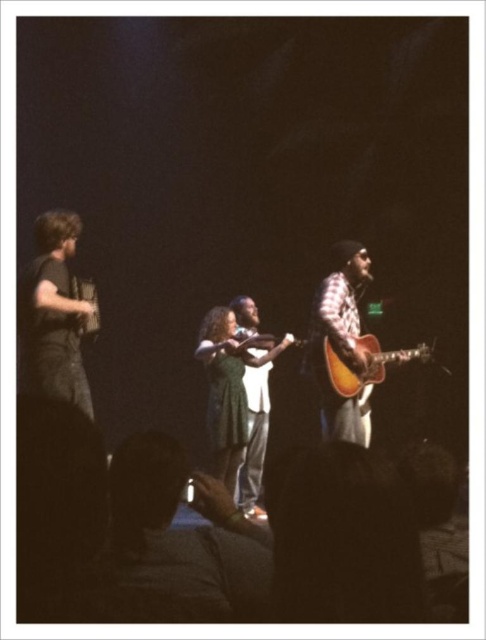
Which of these two, dark gray t-shirt at left or plaid fabric guitar at center, stands taller?

plaid fabric guitar at center is taller.

Does point (63, 280) come closer to viewer compared to point (336, 336)?

Yes, point (63, 280) is in front of point (336, 336).

Is point (52, 387) less distant than point (334, 428)?

That is True.

Locate an element on the screen. The width and height of the screenshot is (486, 640). dark gray t-shirt at left is located at coordinates (52, 316).

Is dark gray t-shirt at left to the left of acoustic wood guitar at center from the viewer's perspective?

Indeed, dark gray t-shirt at left is positioned on the left side of acoustic wood guitar at center.

Is dark gray t-shirt at left taller than acoustic wood guitar at center?

Correct, dark gray t-shirt at left is much taller as acoustic wood guitar at center.

Locate an element on the screen. dark gray t-shirt at left is located at coordinates (52, 316).

Does plaid fabric guitar at center have a larger size compared to acoustic wood guitar at center?

Indeed, plaid fabric guitar at center has a larger size compared to acoustic wood guitar at center.

Who is more distant from viewer, (328, 336) or (335, 376)?

The point (328, 336) is behind.

Locate an element on the screen. The image size is (486, 640). plaid fabric guitar at center is located at coordinates (340, 339).